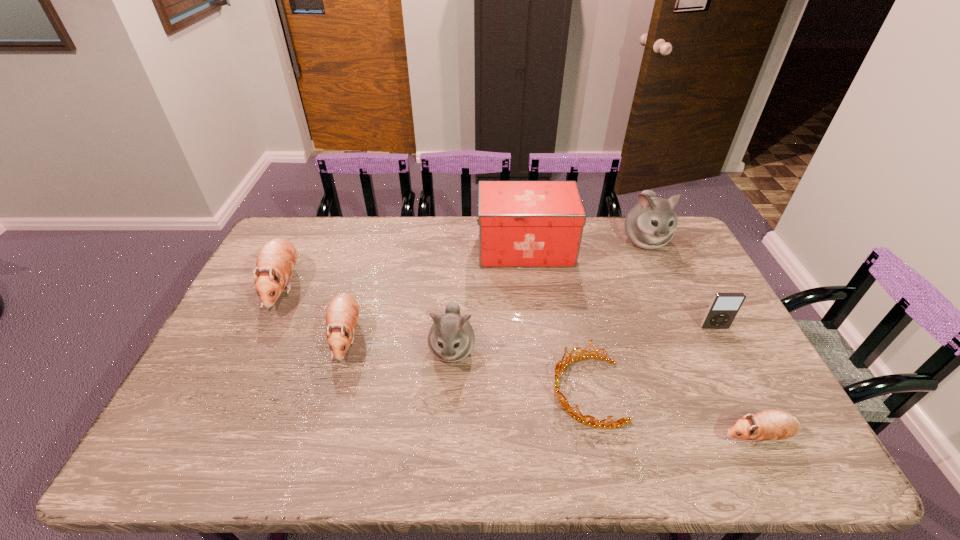
Identify the location of free location located at the face of the fourth hamster from right to left. (323, 418).

Identify the location of vacant space located 0.400m on the front-facing side of the tiara. Image resolution: width=960 pixels, height=540 pixels. (396, 390).

Find the location of a particular element. The image size is (960, 540). vacant space located on the front-facing side of the tiara is located at coordinates (469, 390).

The height and width of the screenshot is (540, 960). Find the location of `vacant space situated on the front-facing side of the tiara`. vacant space situated on the front-facing side of the tiara is located at coordinates (430, 390).

You are a GUI agent. You are given a task and a screenshot of the screen. Output one action in this format:
    pyautogui.click(x=<x>, y=<y>)
    Task: Click on the vacant space located 0.370m at the face of the nearest hamster
    The height and width of the screenshot is (540, 960).
    Given the screenshot: What is the action you would take?
    pyautogui.click(x=564, y=437)

I want to click on free space located at the face of the nearest hamster, so click(657, 437).

Find the location of a particular element. vacant space located 0.090m at the face of the nearest hamster is located at coordinates [x=682, y=437].

Find the location of a particular element. This screenshot has width=960, height=540. the first-aid kit at the far edge is located at coordinates (521, 223).

Find the location of a particular element. hamster at the far edge is located at coordinates (650, 224).

This screenshot has width=960, height=540. I want to click on object at the near edge, so click(x=771, y=424).